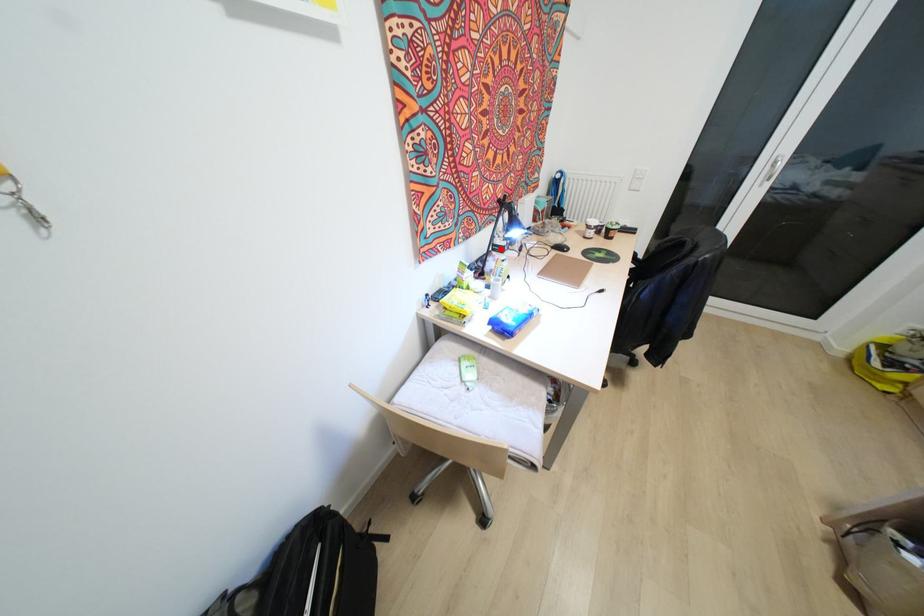
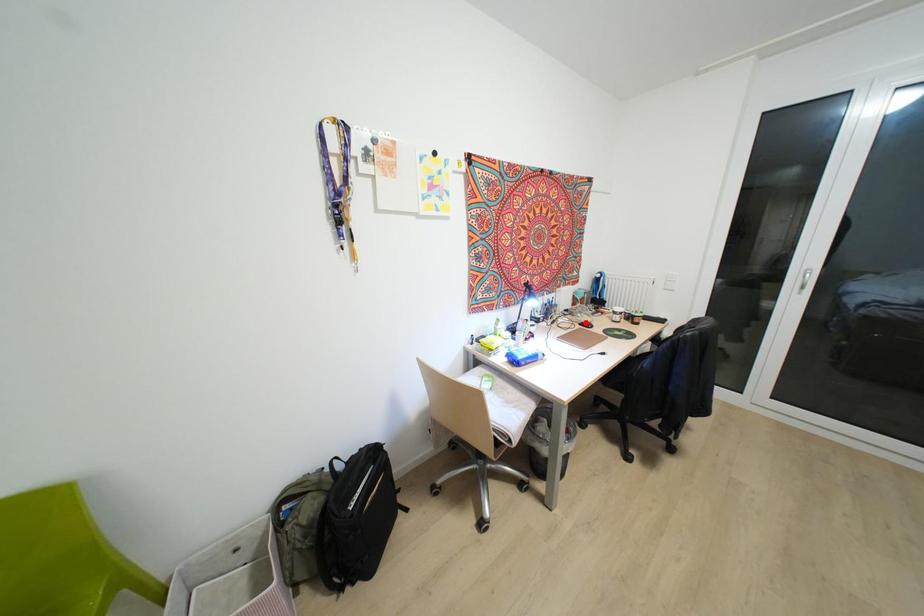
I am providing you with two images of the same scene from different viewpoints. A red point is marked on the first image and another point is marked on the second image. Is the marked point in image1 the same physical position as the marked point in image2?

No